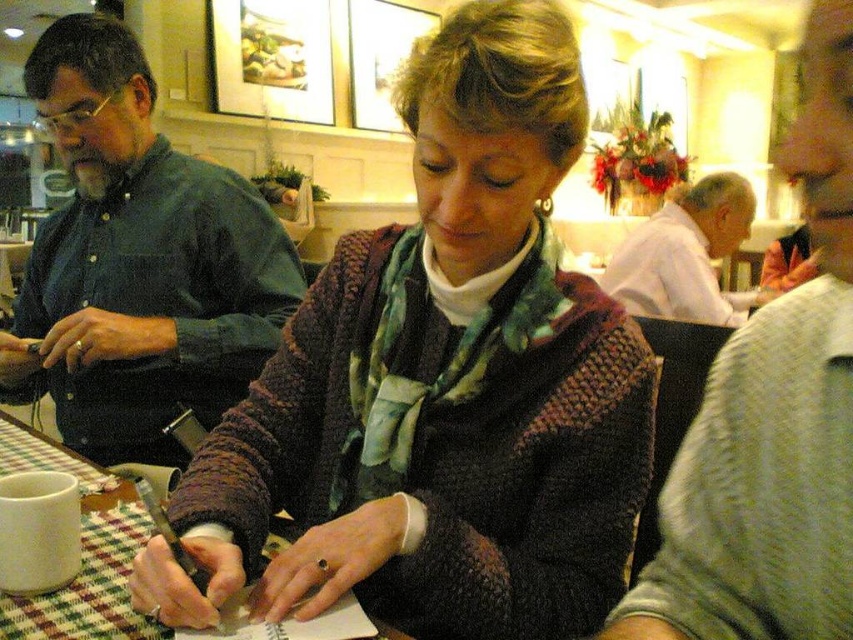
Where is the light pink shirt at center located in the image?

The light pink shirt at center is located at point coordinates of 0.656 in the x axis and 0.906 in the y axis.

You are a customer in this cafe and want to place your phone on the table without it being in the way of the white cotton shirt at upper right. Is the checkered fabric table at center a good spot for this?

Yes, the checkered fabric table at center is positioned under the white cotton shirt at upper right, so placing the phone there would keep it out of the shirt area.

You are a customer at the cafe and want to place your phone on the checkered fabric table at center. However, you also have a white cotton shirt at upper right that you want to lay flat. Based on their sizes, which item can fit on the table without folding?

The checkered fabric table at center is narrower than the white cotton shirt at upper right, so the shirt would not fit without folding. The table is too small for the shirt, so only the phone can be placed there without folding.